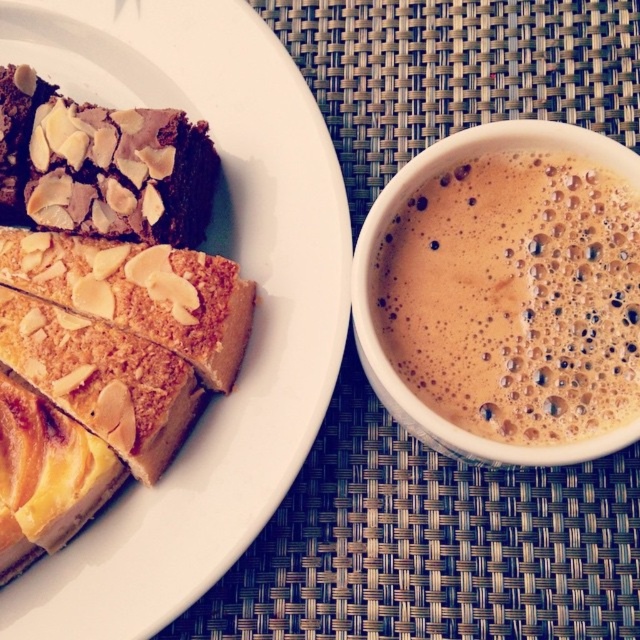
Does brown matte cake at left have a greater width compared to dark brown cake with almond slices at upper left?

Yes.

Which is above, brown matte cake at left or dark brown cake with almond slices at upper left?

dark brown cake with almond slices at upper left

Is point (276, 403) behind point (52, 124)?

No, it is in front of (52, 124).

Find the location of a particular element. This screenshot has width=640, height=640. brown matte cake at left is located at coordinates (243, 273).

Who is lower down, brown matte cake at left or golden crumbly slice at upper left?

Positioned lower is golden crumbly slice at upper left.

Is brown matte cake at left smaller than golden crumbly slice at upper left?

Actually, brown matte cake at left might be larger than golden crumbly slice at upper left.

Which is in front, point (316, 364) or point (243, 353)?

Positioned in front is point (316, 364).

This screenshot has height=640, width=640. What are the coordinates of `brown matte cake at left` in the screenshot? It's located at (243, 273).

You are a GUI agent. You are given a task and a screenshot of the screen. Output one action in this format:
    pyautogui.click(x=<x>, y=<y>)
    Task: Click on the brown matte cake at left
    
    Given the screenshot: What is the action you would take?
    pyautogui.click(x=243, y=273)

Between point (44, 45) and point (580, 394), which one is positioned behind?

The point (44, 45) is more distant.

At what (x,y) coordinates should I click in order to perform the action: click on brown matte cake at left. Please return your answer as a coordinate pair (x, y). The height and width of the screenshot is (640, 640). Looking at the image, I should click on (243, 273).